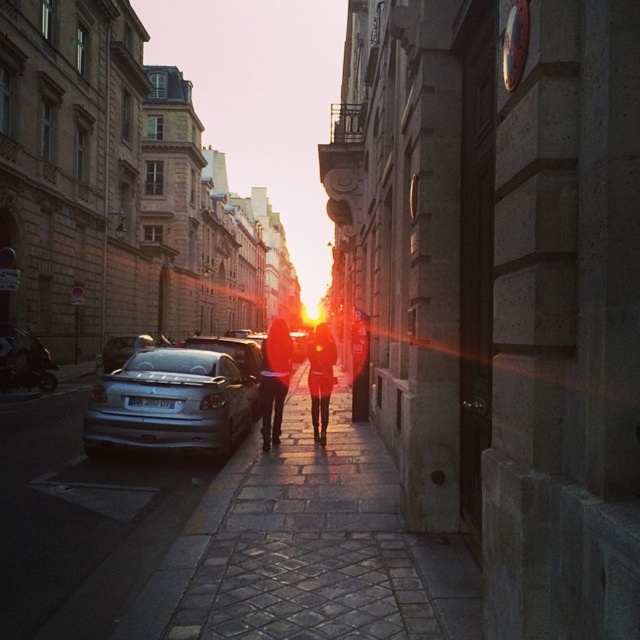
Question: Which object is the closest to the silver metallic car at left?

Choices:
 (A) cobblestone pavement at center
 (B) matte black jacket at center

Answer: (B)

Question: Estimate the real-world distances between objects in this image. Which object is farther from the matte black jacket at center?

Choices:
 (A) cobblestone pavement at center
 (B) silver metallic car at left

Answer: (A)

Question: Is cobblestone pavement at center to the right of matte black dress at center from the viewer's perspective?

Choices:
 (A) yes
 (B) no

Answer: (A)

Question: Among these points, which one is nearest to the camera?

Choices:
 (A) (326, 358)
 (B) (369, 500)
 (C) (150, 422)
 (D) (288, 387)

Answer: (B)

Question: Considering the relative positions of matte black jacket at center and matte black dress at center in the image provided, where is matte black jacket at center located with respect to matte black dress at center?

Choices:
 (A) left
 (B) right

Answer: (A)

Question: Does cobblestone pavement at center appear on the right side of matte black jacket at center?

Choices:
 (A) no
 (B) yes

Answer: (B)